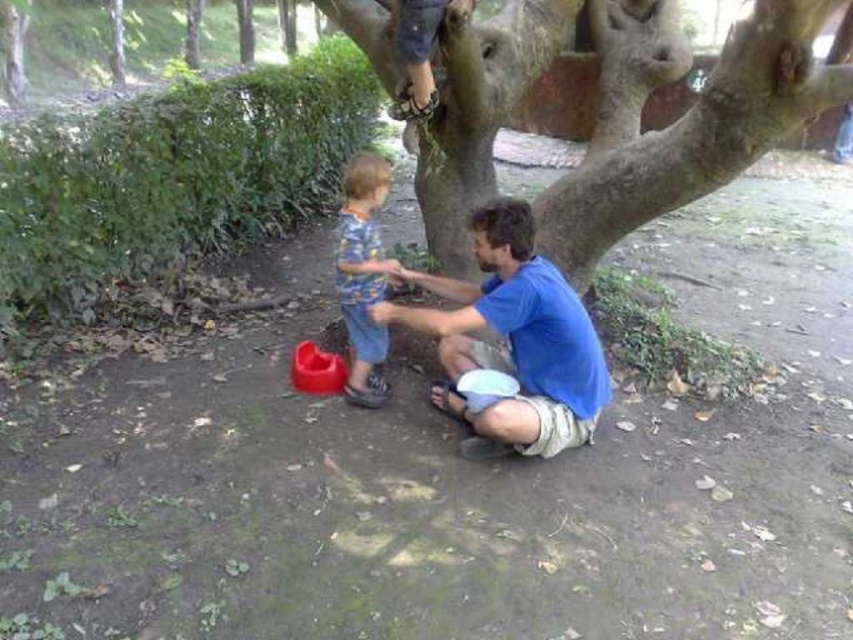
Does blue cotton shirt at center appear on the right side of matte blue shirt at center?

Correct, you'll find blue cotton shirt at center to the right of matte blue shirt at center.

At what (x,y) coordinates should I click in order to perform the action: click on blue cotton shirt at center. Please return your answer as a coordinate pair (x, y). Looking at the image, I should click on (514, 337).

The image size is (853, 640). Find the location of `blue cotton shirt at center`. blue cotton shirt at center is located at coordinates (514, 337).

Is rough bark tree at center behind matte blue shirt at center?

No.

Who is shorter, rough bark tree at center or matte blue shirt at center?

matte blue shirt at center

This screenshot has width=853, height=640. I want to click on rough bark tree at center, so click(x=682, y=120).

Between point (344, 17) and point (537, 442), which one is positioned in front?

Point (537, 442) is more forward.

Does point (782, 6) come closer to viewer compared to point (457, 328)?

Yes, point (782, 6) is closer to viewer.

The image size is (853, 640). Identify the location of rough bark tree at center. (682, 120).